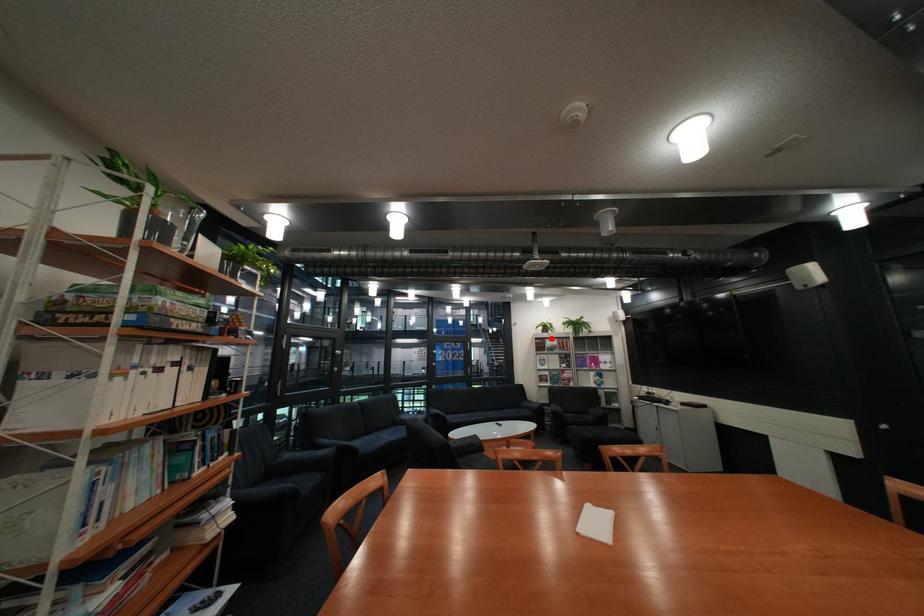
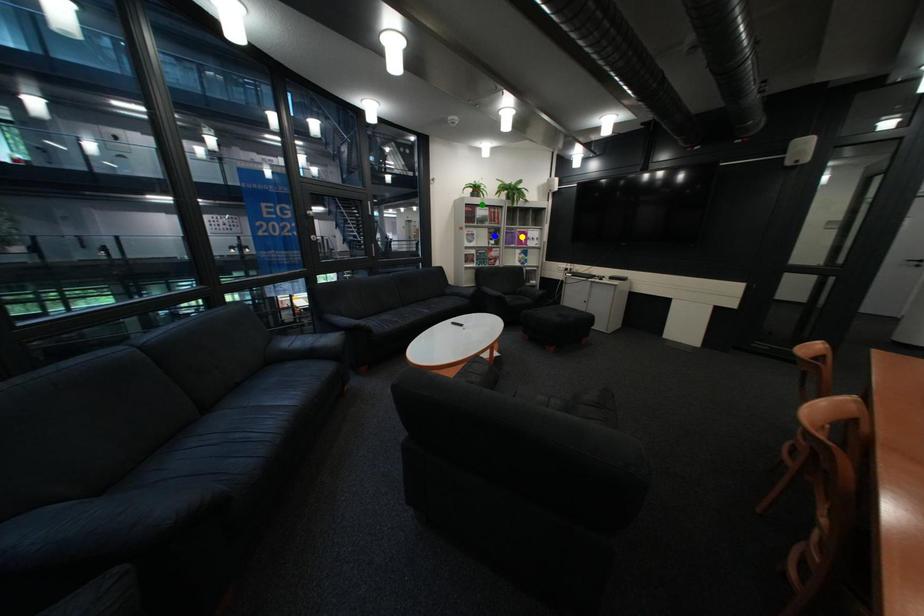
Question: I am providing you with two images of the same scene from different viewpoints. A red point is marked on the first image. You are given multiple points on the second image. Which spot in image 2 lines up with the point in image 1?

Choices:
 (A) blue point
 (B) green point
 (C) yellow point

Answer: (B)